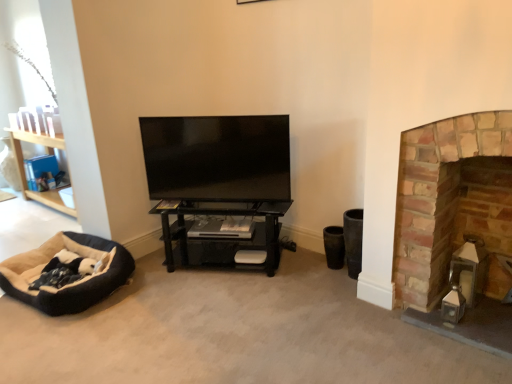
At what (x,y) coordinates should I click in order to perform the action: click on vacant space in front of black matte shelf at center. Please return your answer as a coordinate pair (x, y). Looking at the image, I should click on (217, 324).